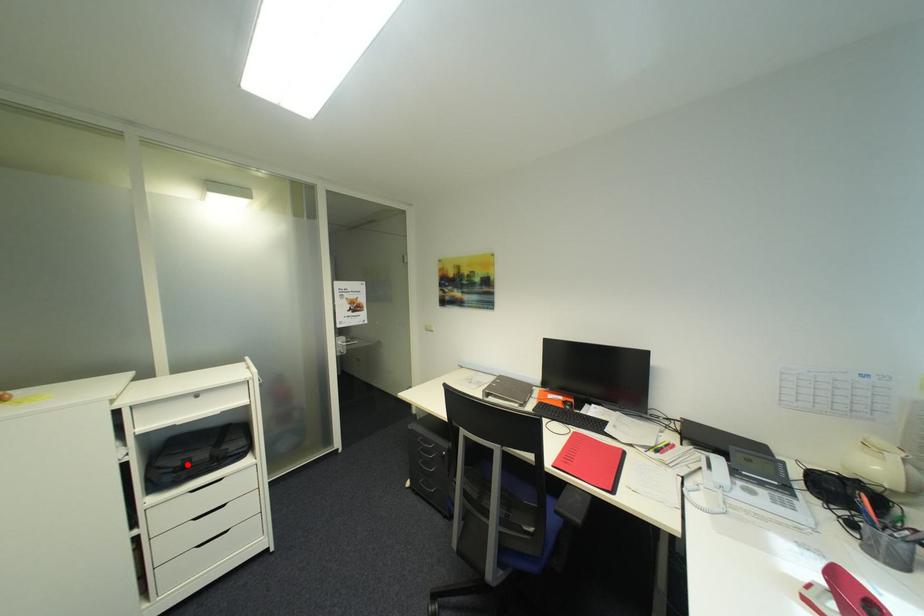
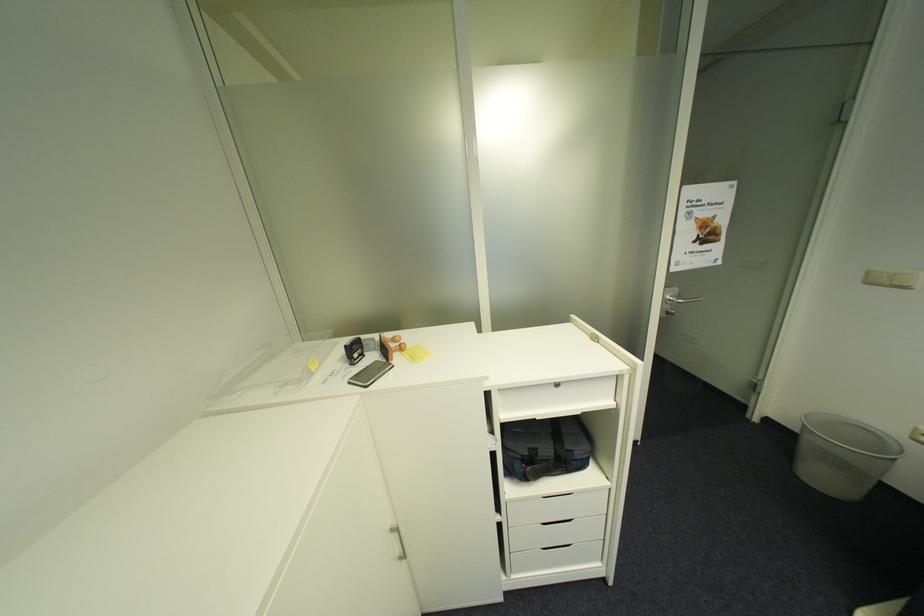
Question: I am providing you with two images of the same scene from different viewpoints. In image1, a red point is highlighted. Considering the same 3D point in image2, which of the following is correct?

Choices:
 (A) It is closer
 (B) It is farther

Answer: (B)